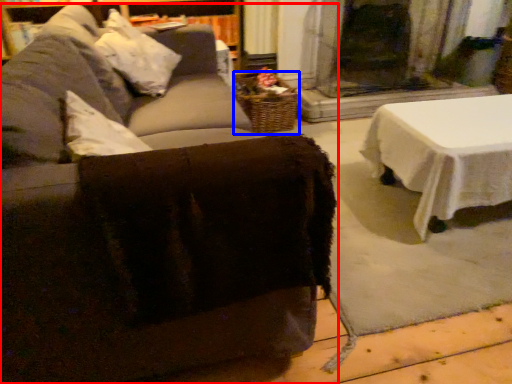
Question: Among these objects, which one is farthest to the camera, studio couch (highlighted by a red box) or basket (highlighted by a blue box)?

Choices:
 (A) studio couch
 (B) basket

Answer: (B)